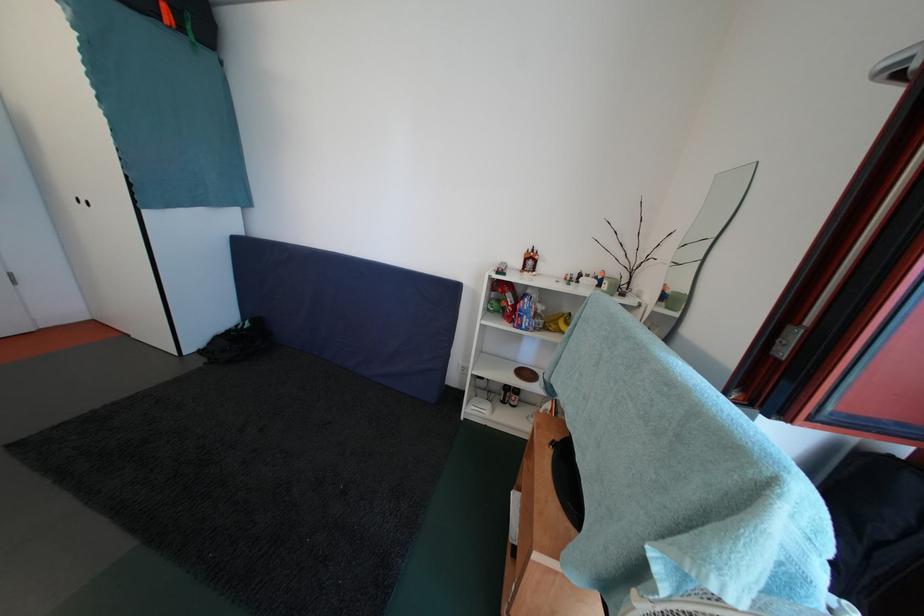
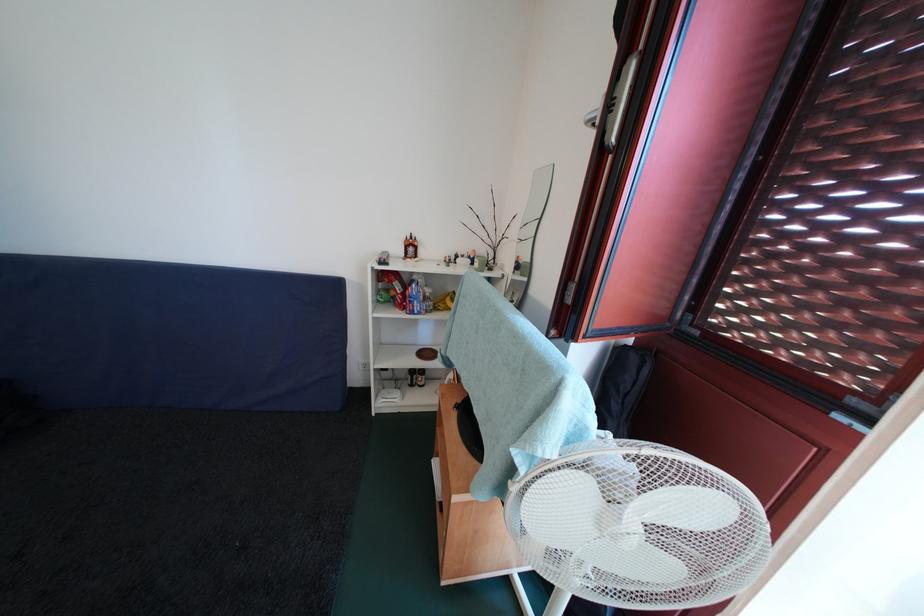
Where in the second image is the point corresponding to pixel 532 322 from the first image?

(422, 307)